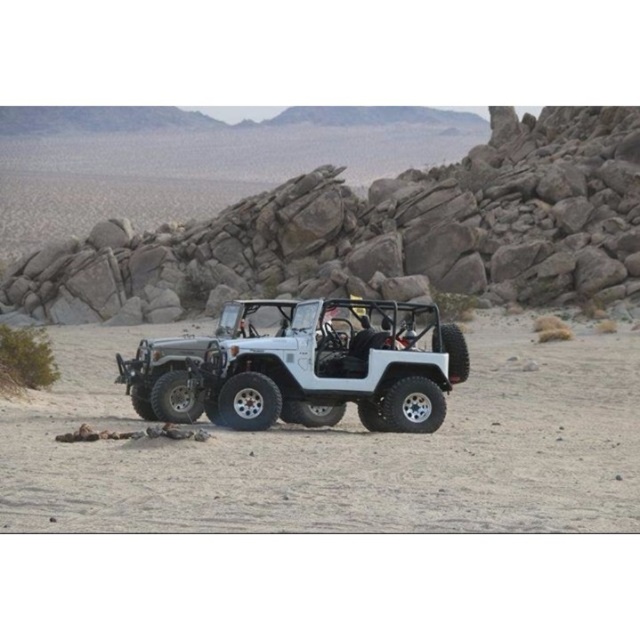
Does white matte sand at center lie in front of white matte jeep at center?

Yes.

Does white matte sand at center have a lesser width compared to white matte jeep at center?

Incorrect, white matte sand at center's width is not less than white matte jeep at center's.

Which is in front, point (628, 515) or point (410, 404)?

Positioned in front is point (628, 515).

You are a GUI agent. You are given a task and a screenshot of the screen. Output one action in this format:
    pyautogui.click(x=<x>, y=<y>)
    Task: Click on the white matte sand at center
    The width and height of the screenshot is (640, 640).
    Given the screenshot: What is the action you would take?
    pyautogui.click(x=344, y=449)

Which of these two, rockymaterial/textureformation at upper center or white matte sand at center, stands taller?

rockymaterial/textureformation at upper center is taller.

Does rockymaterial/textureformation at upper center have a greater width compared to white matte sand at center?

Indeed, rockymaterial/textureformation at upper center has a greater width compared to white matte sand at center.

Between point (99, 141) and point (198, 490), which one is positioned in front?

Point (198, 490) is more forward.

Where is `rockymaterial/textureformation at upper center`? The height and width of the screenshot is (640, 640). rockymaterial/textureformation at upper center is located at coordinates (365, 230).

Can you confirm if rockymaterial/textureformation at upper center is thinner than white matte jeep at center?

In fact, rockymaterial/textureformation at upper center might be wider than white matte jeep at center.

Who is lower down, rockymaterial/textureformation at upper center or white matte jeep at center?

white matte jeep at center

Where is `rockymaterial/textureformation at upper center`? rockymaterial/textureformation at upper center is located at coordinates (365, 230).

The image size is (640, 640). In order to click on rockymaterial/textureformation at upper center in this screenshot , I will do `click(365, 230)`.